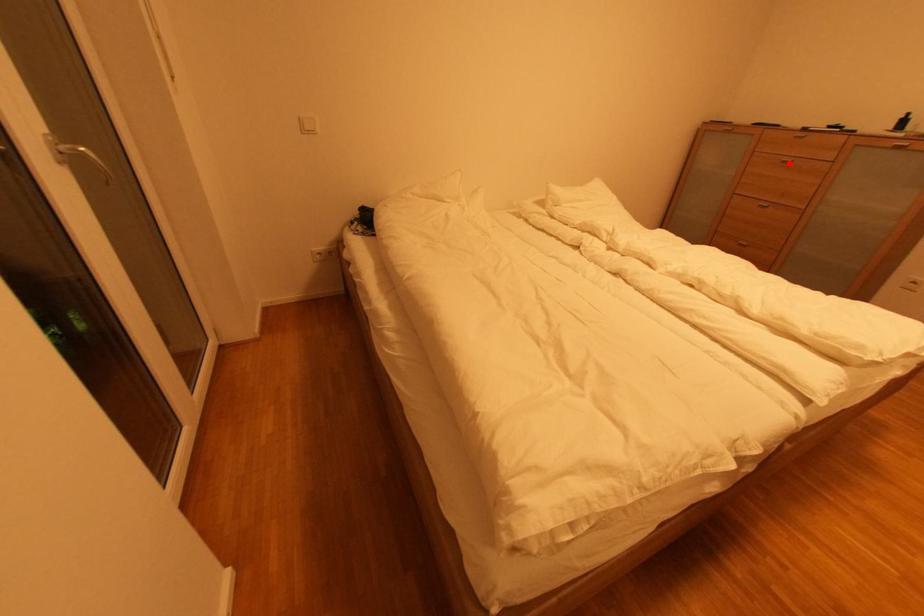
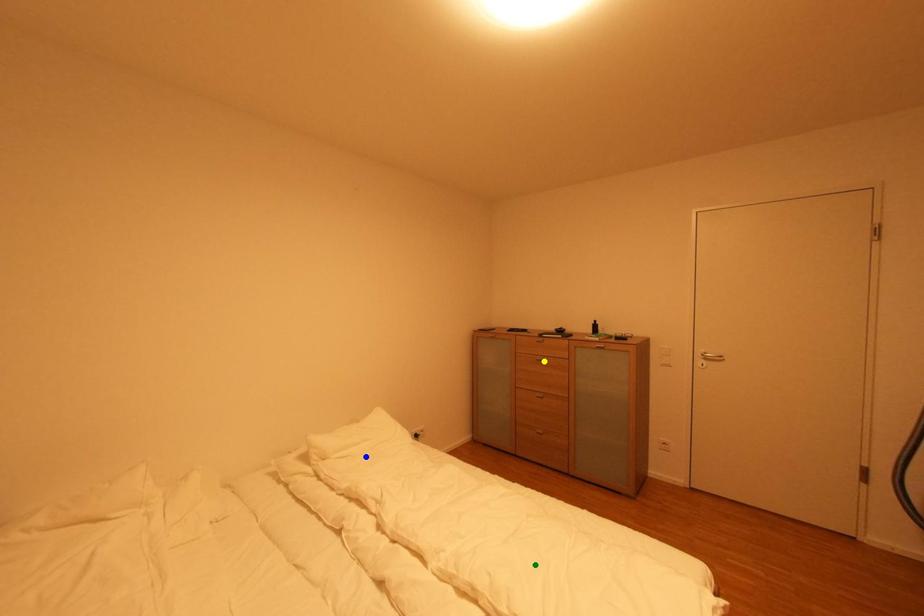
Question: I am providing you with two images of the same scene from different viewpoints. A red point is marked on the first image. You are given multiple points on the second image. Which point in image 2 is actually the same real-world point as the red point in image 1?

Choices:
 (A) green point
 (B) yellow point
 (C) blue point

Answer: (B)